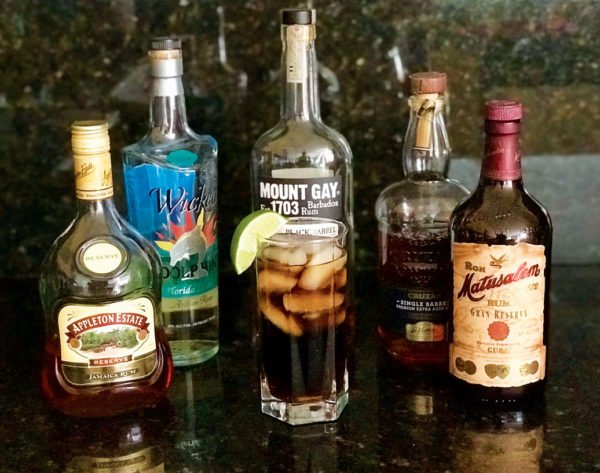
The height and width of the screenshot is (473, 600). I want to click on bottle, so click(x=541, y=236).